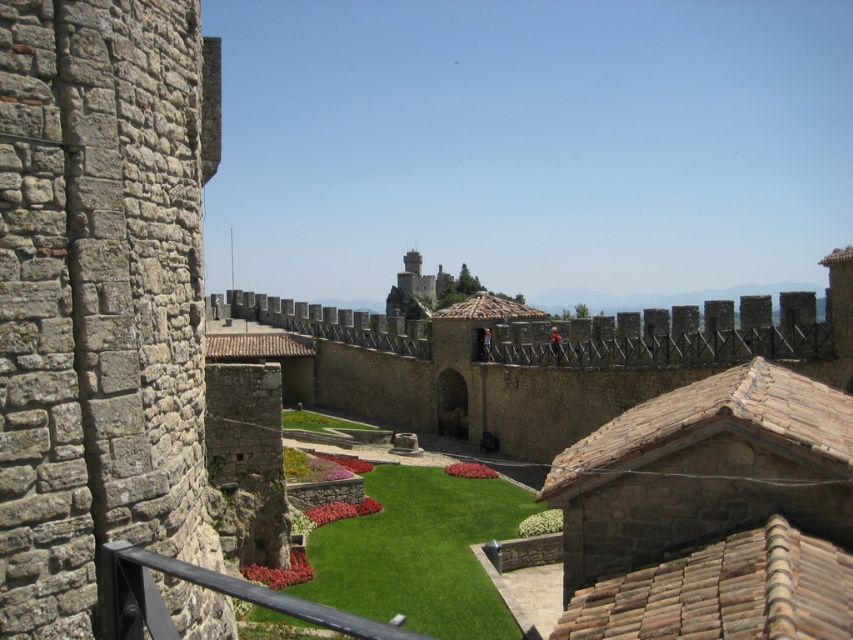
Question: From the image, what is the correct spatial relationship of green artificial turf at center in relation to green grass at center?

Choices:
 (A) left
 (B) right

Answer: (B)

Question: Among these objects, which one is nearest to the camera?

Choices:
 (A) green grass at center
 (B) green artificial turf at center

Answer: (B)

Question: Which object is closer to the camera taking this photo?

Choices:
 (A) green grass at center
 (B) green artificial turf at center

Answer: (B)

Question: Is green artificial turf at center positioned before green grass at center?

Choices:
 (A) no
 (B) yes

Answer: (B)

Question: Can you confirm if green artificial turf at center is wider than green grass at center?

Choices:
 (A) no
 (B) yes

Answer: (B)